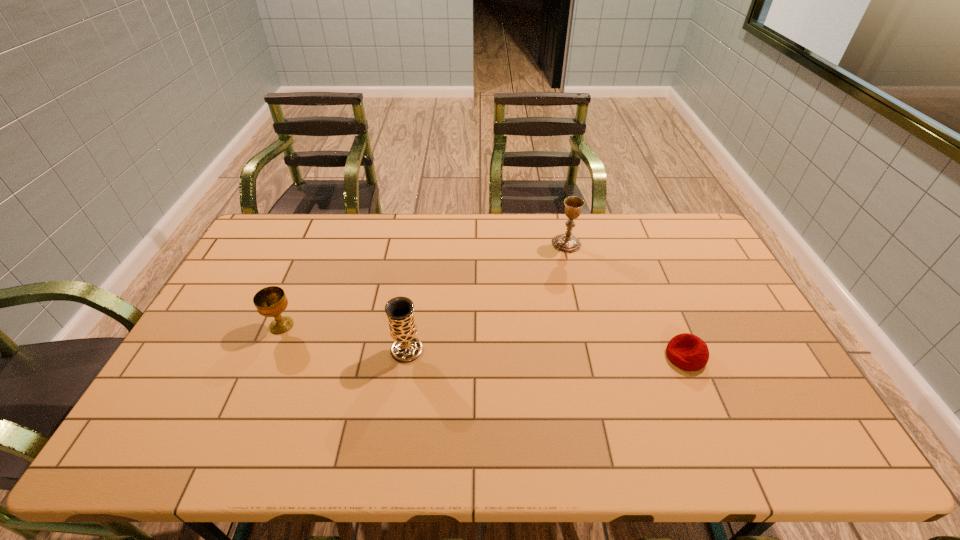
Locate which object is the second closest to the second chalice from left to right. Please provide its 2D coordinates. Your answer should be formatted as a tuple, i.e. [(x, y)], where the tuple contains the x and y coordinates of a point satisfying the conditions above.

[(567, 243)]

Choose which object is the nearest neighbor to the shortest object. Please provide its 2D coordinates. Your answer should be formatted as a tuple, i.e. [(x, y)], where the tuple contains the x and y coordinates of a point satisfying the conditions above.

[(567, 243)]

Locate an element on the screen. This screenshot has height=540, width=960. chalice that is the third closest to the shortest object is located at coordinates (271, 301).

Identify which chalice is the second nearest to the third object from right to left. Please provide its 2D coordinates. Your answer should be formatted as a tuple, i.e. [(x, y)], where the tuple contains the x and y coordinates of a point satisfying the conditions above.

[(567, 243)]